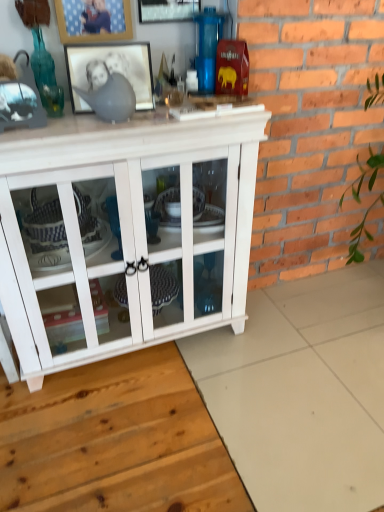
Question: Which direction should I rotate to look at wooden picture frame at upper center, the second picture frame in the bottom-to-top sequence?

Choices:
 (A) right
 (B) left

Answer: (B)

Question: Could you tell me if white wood cabinet at center is facing metallic silver picture frame at upper center, acting as the third picture frame starting from the bottom?

Choices:
 (A) no
 (B) yes

Answer: (A)

Question: Is the surface of white wood cabinet at center in direct contact with metallic silver picture frame at upper center, acting as the third picture frame starting from the bottom?

Choices:
 (A) no
 (B) yes

Answer: (A)

Question: Is white wood cabinet at center facing away from metallic silver picture frame at upper center, which appears as the 1th picture frame when viewed from the top?

Choices:
 (A) no
 (B) yes

Answer: (A)

Question: Does white wood cabinet at center have a lesser width compared to metallic silver picture frame at upper center, which appears as the 1th picture frame when viewed from the top?

Choices:
 (A) yes
 (B) no

Answer: (B)

Question: From a real-world perspective, is white wood cabinet at center under metallic silver picture frame at upper center, which appears as the 1th picture frame when viewed from the top?

Choices:
 (A) yes
 (B) no

Answer: (A)

Question: Is white wood cabinet at center smaller than metallic silver picture frame at upper center, which appears as the 1th picture frame when viewed from the top?

Choices:
 (A) no
 (B) yes

Answer: (A)

Question: Considering the relative sizes of wooden picture frame at upper center, the second picture frame in the bottom-to-top sequence, and black matte picture frame at upper center, which ranks as the 1th picture frame in bottom-to-top order, in the image provided, is wooden picture frame at upper center, the second picture frame in the bottom-to-top sequence, taller than black matte picture frame at upper center, which ranks as the 1th picture frame in bottom-to-top order,?

Choices:
 (A) no
 (B) yes

Answer: (B)

Question: Is wooden picture frame at upper center, the second picture frame in the bottom-to-top sequence, looking in the opposite direction of black matte picture frame at upper center, which ranks as the 1th picture frame in bottom-to-top order?

Choices:
 (A) yes
 (B) no

Answer: (B)

Question: Considering the relative positions of wooden picture frame at upper center, the second picture frame in the bottom-to-top sequence, and black matte picture frame at upper center, which ranks as the 1th picture frame in bottom-to-top order, in the image provided, is wooden picture frame at upper center, the second picture frame in the bottom-to-top sequence, in front of black matte picture frame at upper center, which ranks as the 1th picture frame in bottom-to-top order,?

Choices:
 (A) yes
 (B) no

Answer: (B)

Question: From a real-world perspective, is wooden picture frame at upper center, which ranks as the second picture frame in top-to-bottom order, physically above black matte picture frame at upper center, which is counted as the third picture frame, starting from the top?

Choices:
 (A) no
 (B) yes

Answer: (B)

Question: Can you confirm if wooden picture frame at upper center, which ranks as the second picture frame in top-to-bottom order, is wider than black matte picture frame at upper center, which is counted as the third picture frame, starting from the top?

Choices:
 (A) yes
 (B) no

Answer: (B)

Question: Is wooden picture frame at upper center, which ranks as the second picture frame in top-to-bottom order, thinner than black matte picture frame at upper center, which is counted as the third picture frame, starting from the top?

Choices:
 (A) yes
 (B) no

Answer: (A)

Question: Is metallic silver picture frame at upper center, which appears as the 1th picture frame when viewed from the top, positioned behind white wood cabinet at center?

Choices:
 (A) no
 (B) yes

Answer: (B)